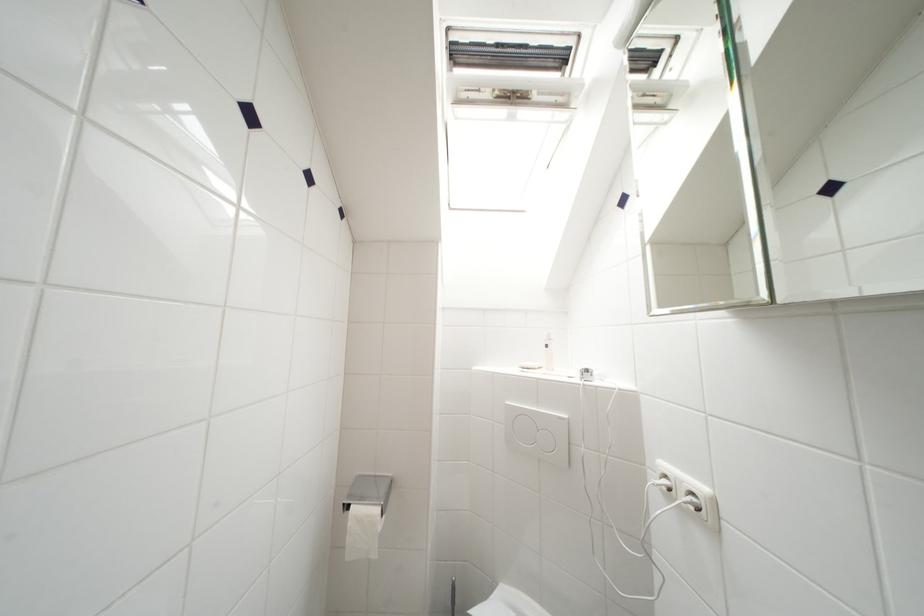
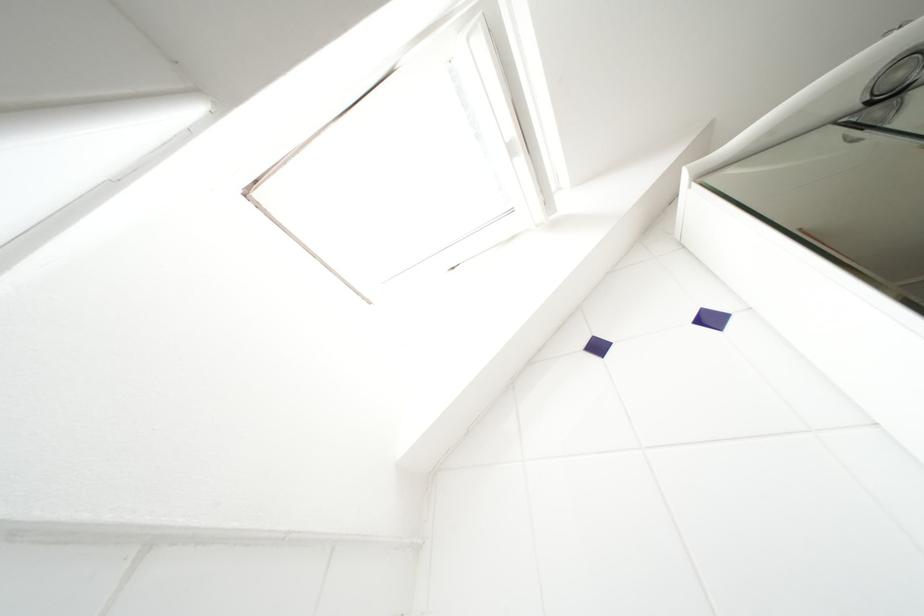
How did the camera likely rotate?

The camera's rotation is toward right-up.